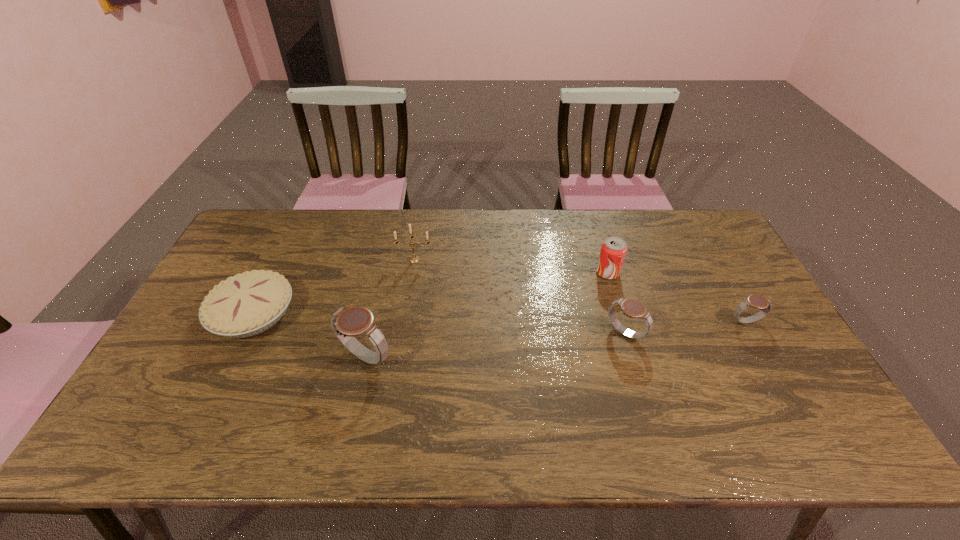
The image size is (960, 540). What are the coordinates of `the tallest watch` in the screenshot? It's located at (347, 323).

Image resolution: width=960 pixels, height=540 pixels. I want to click on the second watch from left to right, so click(632, 308).

The height and width of the screenshot is (540, 960). Identify the location of the shortest watch. (764, 304).

Locate an element on the screen. This screenshot has height=540, width=960. the rightmost object is located at coordinates (764, 304).

Find the location of a particular element. The width and height of the screenshot is (960, 540). the leftmost object is located at coordinates (247, 304).

The image size is (960, 540). Identify the location of soda can. click(x=613, y=251).

Locate an element on the screen. the farthest object is located at coordinates (414, 259).

Where is `vacant space situated on the back of the tallest watch`? This screenshot has height=540, width=960. vacant space situated on the back of the tallest watch is located at coordinates (386, 268).

The width and height of the screenshot is (960, 540). I want to click on free space located on the left of the second tallest watch, so click(463, 333).

Identify the location of vacant space situated 0.290m on the back of the rightmost object. The width and height of the screenshot is (960, 540). (705, 250).